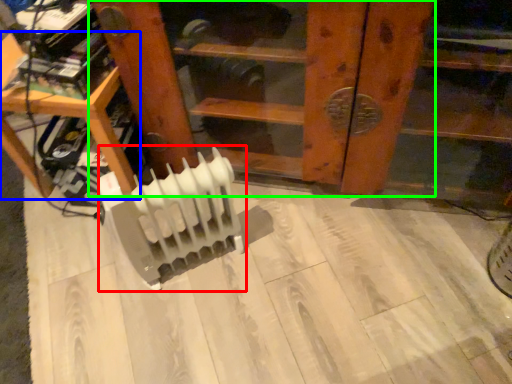
Question: Based on their relative distances, which object is farther from radiator (highlighted by a red box)? Choose from furniture (highlighted by a blue box) and furniture (highlighted by a green box).

Choices:
 (A) furniture
 (B) furniture

Answer: (B)